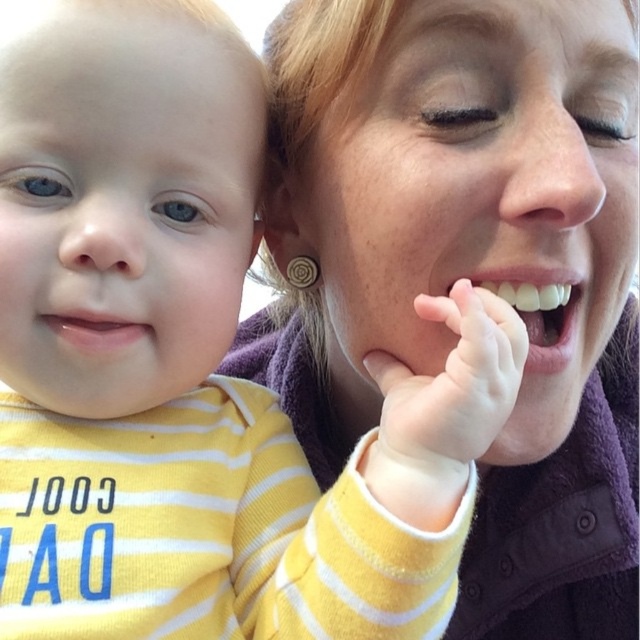
Question: Estimate the real-world distances between objects in this image. Which object is closer to the white glossy teeth at center?

Choices:
 (A) matte yellow lip at lower left
 (B) matte purple jacket at center

Answer: (B)

Question: Can you confirm if matte purple jacket at center is thinner than white glossy teeth at center?

Choices:
 (A) yes
 (B) no

Answer: (B)

Question: Is soft pink skin at mouth right thinner than white glossy teeth at center?

Choices:
 (A) no
 (B) yes

Answer: (B)

Question: Which point is closer to the camera?

Choices:
 (A) (99, 340)
 (B) (564, 332)
 (C) (440, 323)

Answer: (A)

Question: Which point is closer to the camera?

Choices:
 (A) matte purple jacket at center
 (B) soft pink skin at mouth right
 (C) white glossy teeth at center
 (D) matte yellow lip at lower left

Answer: (B)

Question: Can you confirm if soft pink skin at mouth right is positioned below white glossy teeth at center?

Choices:
 (A) no
 (B) yes

Answer: (B)